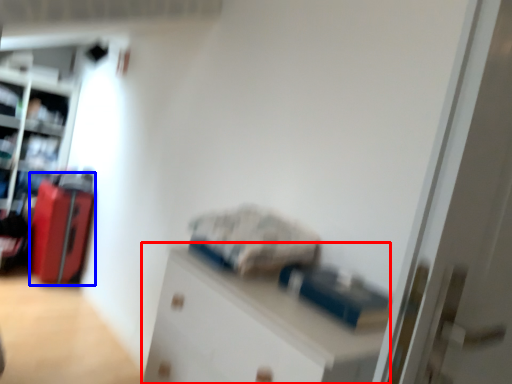
Question: Which of the following is the closest to the observer, cabinetry (highlighted by a red box) or luggage (highlighted by a blue box)?

Choices:
 (A) cabinetry
 (B) luggage

Answer: (A)